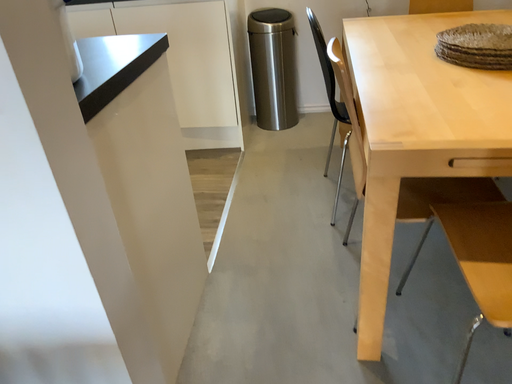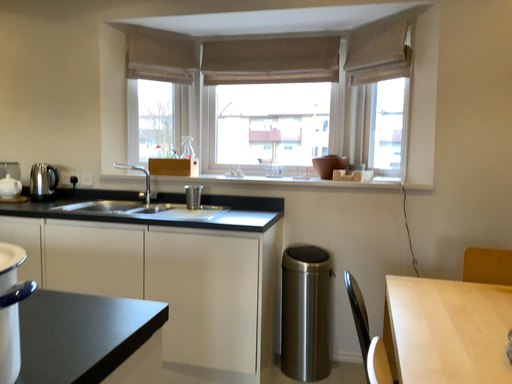
Question: Which way did the camera rotate in the video?

Choices:
 (A) rotated upward
 (B) rotated downward

Answer: (A)